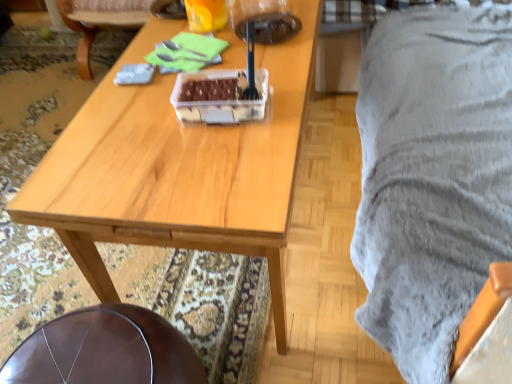
Where is `blank space to the left of translucent plastic container at center`? The image size is (512, 384). blank space to the left of translucent plastic container at center is located at coordinates (146, 120).